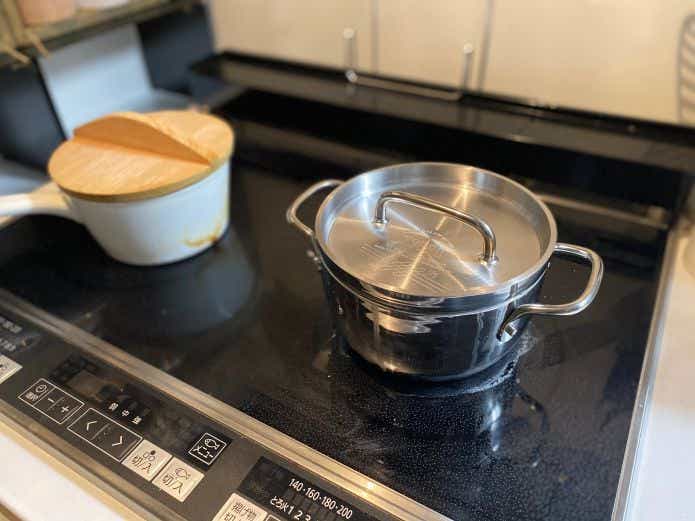
Find the location of a particular element. Image resolution: width=695 pixels, height=521 pixels. wooden lid of the pot is located at coordinates (117, 170).